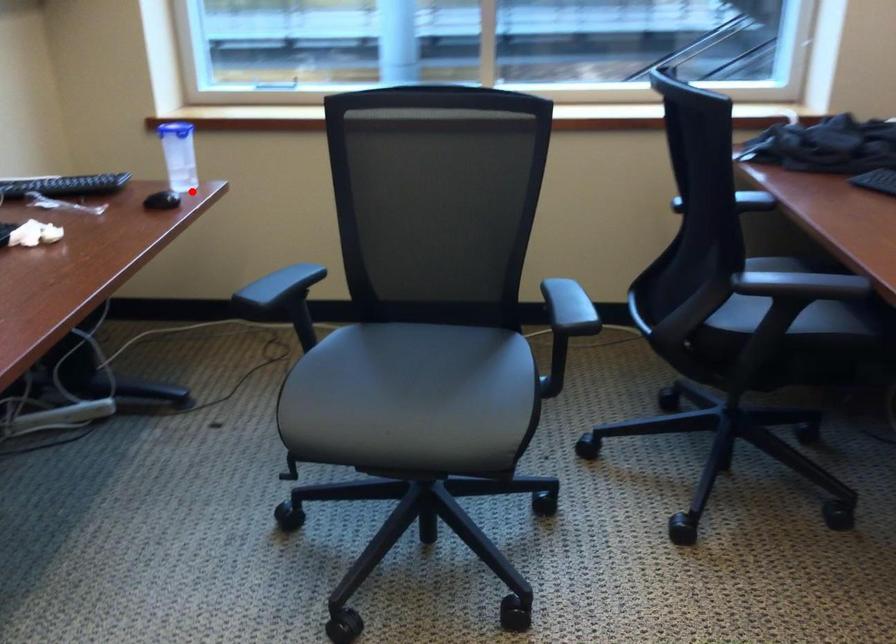
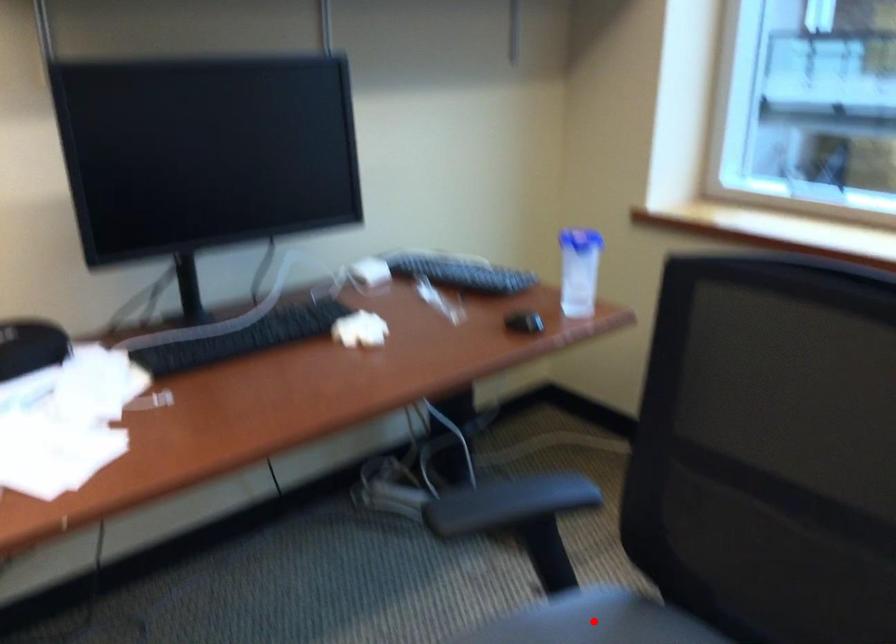
I am providing you with two images of the same scene from different viewpoints. A red point is marked on the first image and another point is marked on the second image. Is the red point in image1 aligned with the point shown in image2?

No